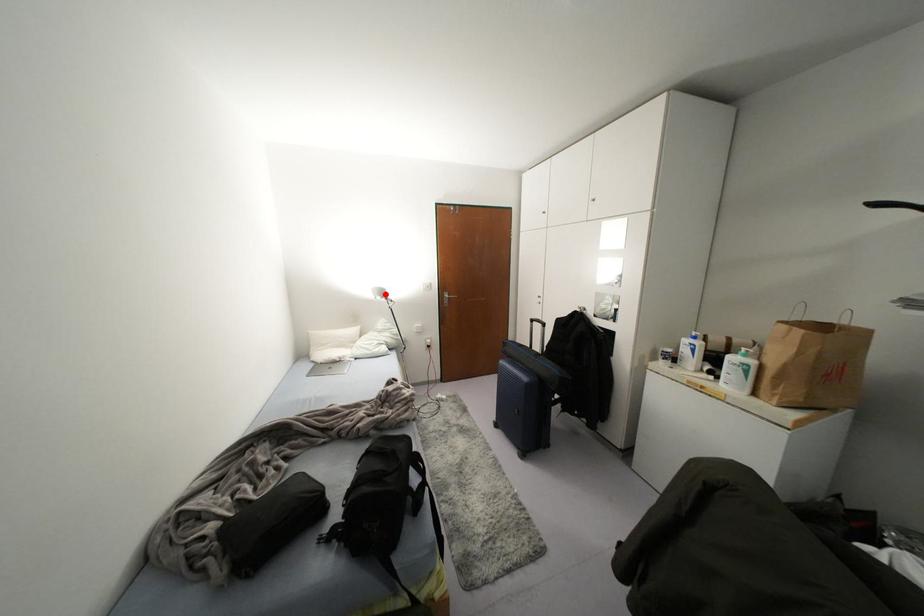
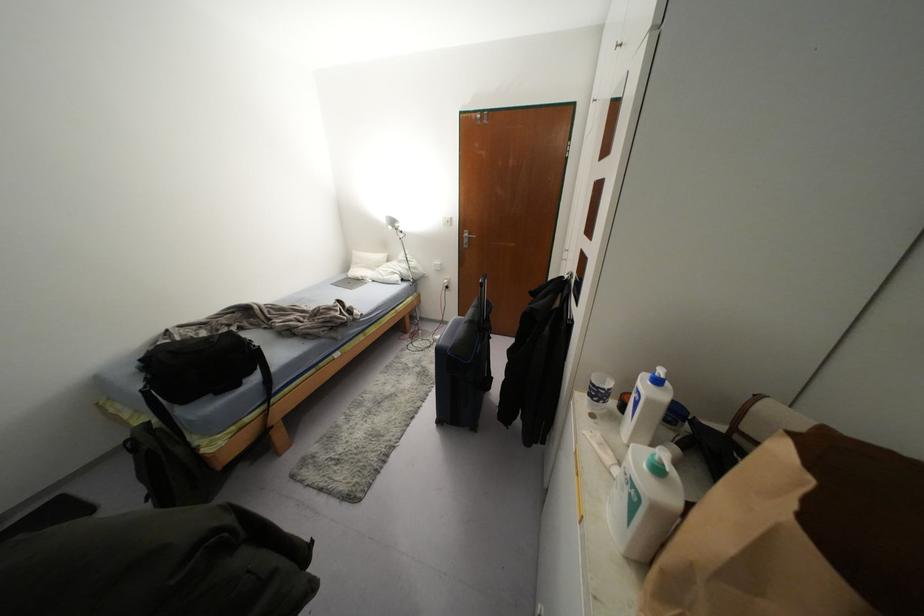
In the second image, find the point that corresponds to the highlighted location in the first image.

(395, 225)